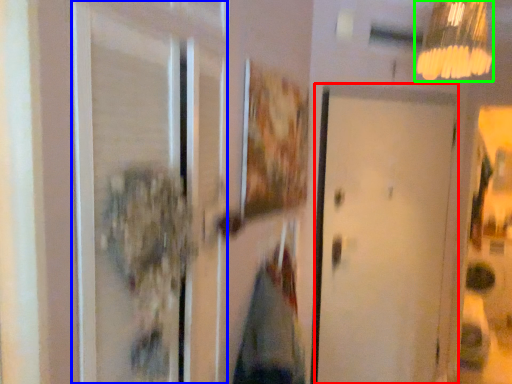
Question: Estimate the real-world distances between objects in this image. Which object is closer to door (highlighted by a red box), screen door (highlighted by a blue box) or lamp (highlighted by a green box)?

Choices:
 (A) screen door
 (B) lamp

Answer: (B)